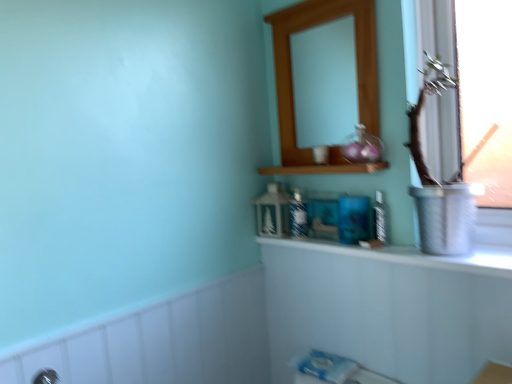
Question: Is white glossy counter top at upper center positioned with its back to wooden medicine cabinet at upper center?

Choices:
 (A) yes
 (B) no

Answer: (B)

Question: Is white glossy counter top at upper center wider than wooden medicine cabinet at upper center?

Choices:
 (A) yes
 (B) no

Answer: (A)

Question: Is white glossy counter top at upper center positioned beyond the bounds of wooden medicine cabinet at upper center?

Choices:
 (A) yes
 (B) no

Answer: (A)

Question: Is white glossy counter top at upper center smaller than wooden medicine cabinet at upper center?

Choices:
 (A) yes
 (B) no

Answer: (A)

Question: Does white glossy counter top at upper center have a greater height compared to wooden medicine cabinet at upper center?

Choices:
 (A) yes
 (B) no

Answer: (B)

Question: Is wooden medicine cabinet at upper center wider or thinner than metallic silver vase at right?

Choices:
 (A) wide
 (B) thin

Answer: (B)

Question: Based on their sizes in the image, would you say wooden medicine cabinet at upper center is bigger or smaller than metallic silver vase at right?

Choices:
 (A) small
 (B) big

Answer: (A)

Question: Is wooden medicine cabinet at upper center taller or shorter than metallic silver vase at right?

Choices:
 (A) short
 (B) tall

Answer: (B)

Question: Choose the correct answer: Is wooden medicine cabinet at upper center inside metallic silver vase at right or outside it?

Choices:
 (A) outside
 (B) inside

Answer: (A)

Question: Considering the positions of matte blue glass toiletry at center, which is counted as the first toiletry, starting from the back, and white textured bath at lower left in the image, is matte blue glass toiletry at center, which is counted as the first toiletry, starting from the back, wider or thinner than white textured bath at lower left?

Choices:
 (A) wide
 (B) thin

Answer: (A)

Question: Based on their sizes in the image, would you say matte blue glass toiletry at center, which is counted as the first toiletry, starting from the back, is bigger or smaller than white textured bath at lower left?

Choices:
 (A) big
 (B) small

Answer: (B)

Question: Is matte blue glass toiletry at center, positioned as the second toiletry in right-to-left order, to the left or to the right of white textured bath at lower left in the image?

Choices:
 (A) left
 (B) right

Answer: (B)

Question: Considering the positions of matte blue glass toiletry at center, which is the 1th toiletry in left-to-right order, and white textured bath at lower left in the image, is matte blue glass toiletry at center, which is the 1th toiletry in left-to-right order, taller or shorter than white textured bath at lower left?

Choices:
 (A) short
 (B) tall

Answer: (A)

Question: From a real-world perspective, relative to clear plastic bottle at center, which appears as the second toiletry when viewed from the back, is wooden medicine cabinet at upper center vertically above or below?

Choices:
 (A) above
 (B) below

Answer: (A)

Question: In terms of size, does wooden medicine cabinet at upper center appear bigger or smaller than clear plastic bottle at center, which is counted as the second toiletry, starting from the left?

Choices:
 (A) big
 (B) small

Answer: (A)